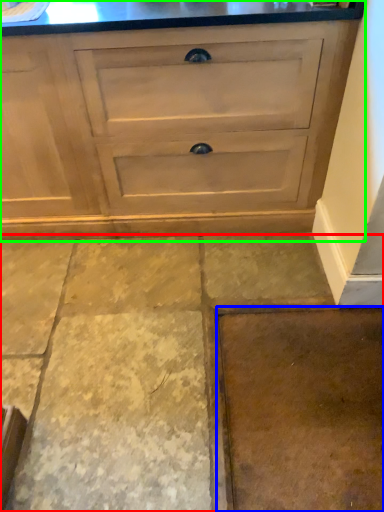
Question: Considering the real-world distances, which object is closest to concrete (highlighted by a red box)? concrete (highlighted by a blue box) or chest of drawers (highlighted by a green box).

Choices:
 (A) concrete
 (B) chest of drawers

Answer: (A)